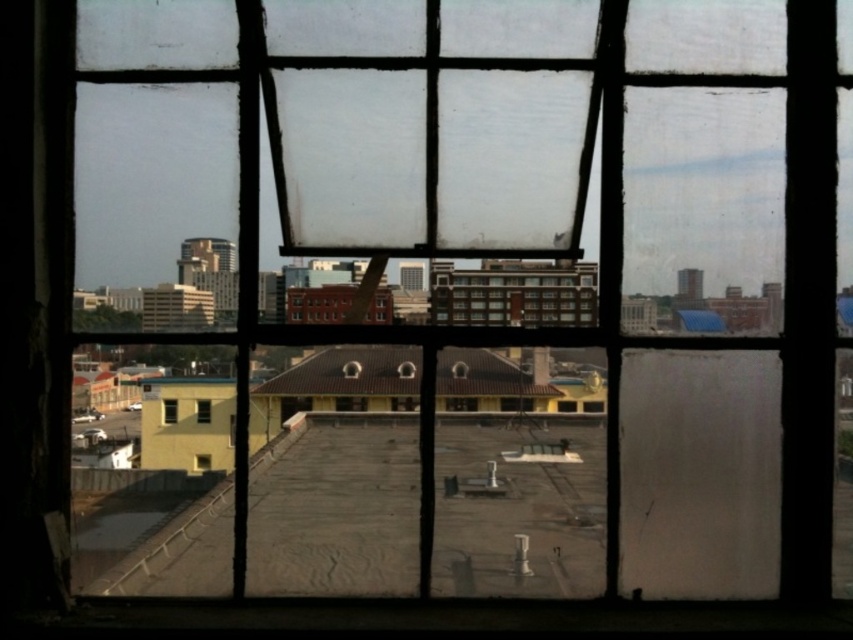
Question: Is transparent glass window at center to the right of clear glass window at center from the viewer's perspective?

Choices:
 (A) yes
 (B) no

Answer: (A)

Question: Which object appears closest to the camera in this image?

Choices:
 (A) transparent glass window at center
 (B) clear glass window at center
 (C) matte yellow window at lower left

Answer: (A)

Question: Which point appears closest to the camera in this image?

Choices:
 (A) (206, 460)
 (B) (165, 406)

Answer: (B)

Question: In this image, where is transparent glass window at center located relative to matte yellow window at lower left?

Choices:
 (A) left
 (B) right

Answer: (B)

Question: Is clear glass window at center smaller than matte yellow window at lower left?

Choices:
 (A) no
 (B) yes

Answer: (A)

Question: Estimate the real-world distances between objects in this image. Which object is farther from the matte yellow window at lower left?

Choices:
 (A) transparent glass window at center
 (B) clear glass window at center

Answer: (B)